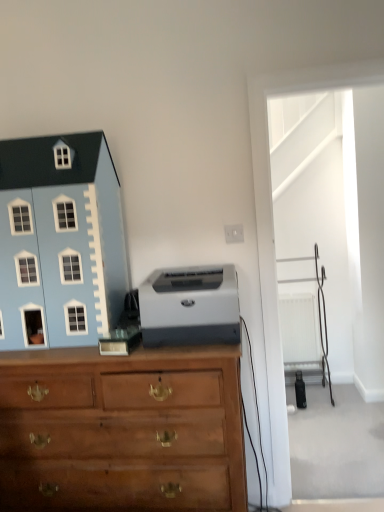
Question: From a real-world perspective, is white plastic radiator at right physically located above or below wooden chest of drawers at center?

Choices:
 (A) above
 (B) below

Answer: (B)

Question: Is white plastic radiator at right spatially inside wooden chest of drawers at center, or outside of it?

Choices:
 (A) inside
 (B) outside

Answer: (B)

Question: Based on their relative distances, which object is nearer to the white plastic radiator at right?

Choices:
 (A) gray matte printer at center
 (B) wooden chest of drawers at center
 (C) light blue plastic toy house at left

Answer: (A)

Question: Which of these objects is positioned farthest from the gray matte printer at center?

Choices:
 (A) wooden chest of drawers at center
 (B) white plastic radiator at right
 (C) light blue plastic toy house at left

Answer: (B)